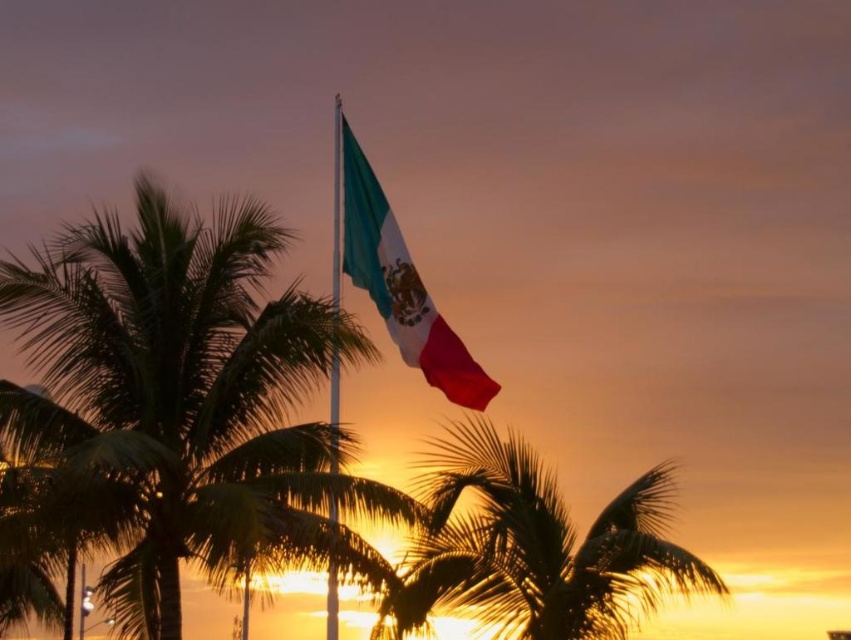
Question: Which object is positioned farthest from the silky fabric flag at center?

Choices:
 (A) green leafy palm tree at center
 (B) metallic flag pole at center

Answer: (A)

Question: Can you confirm if silky fabric flag at center is positioned to the right of metallic flag pole at center?

Choices:
 (A) yes
 (B) no

Answer: (A)

Question: Does green leafy palm tree at center come in front of metallic flag pole at center?

Choices:
 (A) no
 (B) yes

Answer: (B)

Question: Which of these objects is positioned farthest from the metallic flag pole at center?

Choices:
 (A) silky fabric flag at center
 (B) green leafy palm tree at center

Answer: (A)

Question: Estimate the real-world distances between objects in this image. Which object is farther from the green leafy palm tree at center?

Choices:
 (A) silky gold palm tree at center
 (B) metallic flag pole at center
 (C) silky fabric flag at center

Answer: (C)

Question: Considering the relative positions of green leafy palm tree at center and metallic flag pole at center in the image provided, where is green leafy palm tree at center located with respect to metallic flag pole at center?

Choices:
 (A) left
 (B) right

Answer: (A)